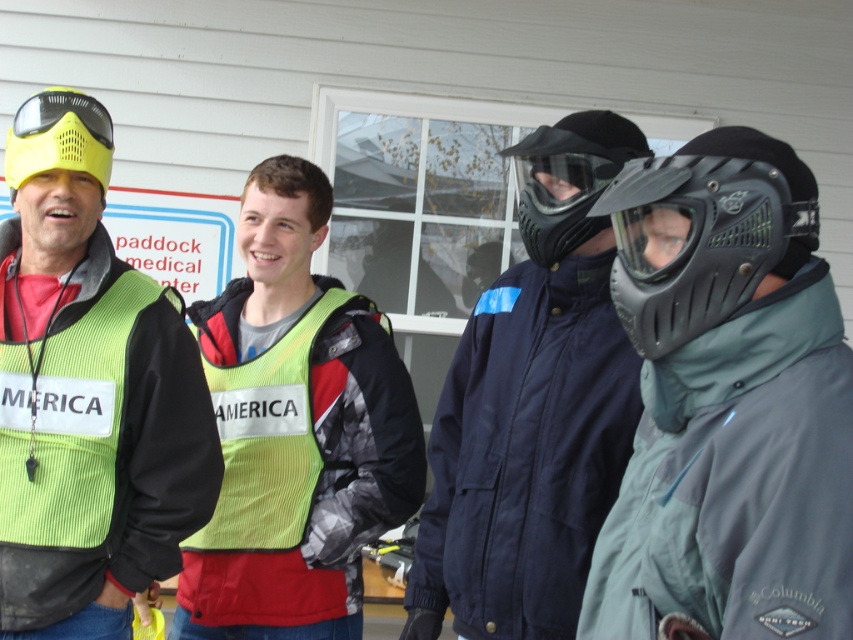
You are a safety inspector evaluating the visibility of safety gear in this group. The matte black helmet at right and the yellow reflective vest at center are both critical for safety. Which item takes up more visual space in the scene?

The yellow reflective vest at center occupies more visual space than the matte black helmet at right, making it more visible.

You are standing in front of the building and looking at the group. Which person is wearing the black matte helmet at right?

The person on the far right is wearing the black matte helmet at right.

You are part of a team preparing for a paintball match and need to ensure all gear fits properly. You have a black matte helmet at right and a black matte mask at center. Which piece of equipment is bigger?

The black matte helmet at right is larger in size than the black matte mask at center, so the helmet is bigger.